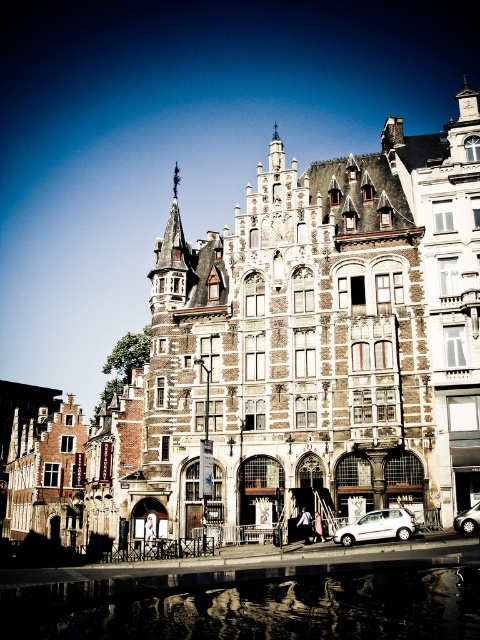
Between white matte car at lower center and white matte car at lower right, which one is positioned higher?

white matte car at lower right is above.

Does white matte car at lower center have a larger size compared to white matte car at lower right?

Yes, white matte car at lower center is bigger than white matte car at lower right.

Who is more distant from viewer, (x=383, y=531) or (x=462, y=524)?

The point (x=462, y=524) is behind.

The height and width of the screenshot is (640, 480). Find the location of `white matte car at lower center`. white matte car at lower center is located at coordinates point(377,525).

Can you confirm if transparent glass water at lower center is bigger than white matte car at lower center?

Indeed, transparent glass water at lower center has a larger size compared to white matte car at lower center.

Between transparent glass water at lower center and white matte car at lower center, which one has less height?

white matte car at lower center

Is point (414, 616) in front of point (371, 529)?

Yes, it is.

Identify the location of transparent glass water at lower center. (253, 608).

Can you confirm if transparent glass water at lower center is positioned to the right of white matte car at lower right?

Incorrect, transparent glass water at lower center is not on the right side of white matte car at lower right.

Is transparent glass water at lower center to the left of white matte car at lower right from the viewer's perspective?

Correct, you'll find transparent glass water at lower center to the left of white matte car at lower right.

The image size is (480, 640). What do you see at coordinates (253, 608) in the screenshot?
I see `transparent glass water at lower center` at bounding box center [253, 608].

Identify the location of transparent glass water at lower center. The width and height of the screenshot is (480, 640). (253, 608).